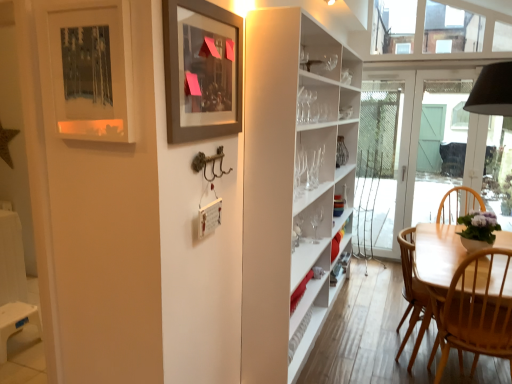
Question: Is light wood chair at lower right positioned beyond the bounds of matte black picture frame at upper left, which is counted as the first picture frame, starting from the left?

Choices:
 (A) no
 (B) yes

Answer: (B)

Question: Is light wood chair at lower right shorter than matte black picture frame at upper left, which ranks as the 2th picture frame in right-to-left order?

Choices:
 (A) no
 (B) yes

Answer: (A)

Question: Would you consider light wood chair at lower right to be distant from matte black picture frame at upper left, which ranks as the 2th picture frame in right-to-left order?

Choices:
 (A) yes
 (B) no

Answer: (A)

Question: Is light wood chair at lower right oriented towards matte black picture frame at upper left, which ranks as the 2th picture frame in right-to-left order?

Choices:
 (A) yes
 (B) no

Answer: (B)

Question: Is matte black picture frame at upper left, which is counted as the first picture frame, starting from the left, completely or partially inside light wood chair at lower right?

Choices:
 (A) no
 (B) yes

Answer: (A)

Question: Relative to white glass door at center, is matte black picture frame at upper left, which is counted as the first picture frame, starting from the left, in front or behind?

Choices:
 (A) front
 (B) behind

Answer: (A)

Question: In terms of height, does matte black picture frame at upper left, which is counted as the first picture frame, starting from the left, look taller or shorter compared to white glass door at center?

Choices:
 (A) tall
 (B) short

Answer: (B)

Question: Considering the relative positions of matte black picture frame at upper left, which is counted as the first picture frame, starting from the left, and white glass door at center in the image provided, is matte black picture frame at upper left, which is counted as the first picture frame, starting from the left, to the left or to the right of white glass door at center?

Choices:
 (A) left
 (B) right

Answer: (A)

Question: Is point (69, 89) positioned closer to the camera than point (437, 86)?

Choices:
 (A) closer
 (B) farther

Answer: (A)

Question: Is white glass door at center inside or outside of light wood chair at lower right?

Choices:
 (A) outside
 (B) inside

Answer: (A)

Question: Is white glass door at center to the left or to the right of light wood chair at lower right in the image?

Choices:
 (A) left
 (B) right

Answer: (B)

Question: In terms of width, does white glass door at center look wider or thinner when compared to light wood chair at lower right?

Choices:
 (A) wide
 (B) thin

Answer: (B)

Question: Is white glass door at center taller or shorter than light wood chair at lower right?

Choices:
 (A) short
 (B) tall

Answer: (B)

Question: Looking at their shapes, would you say matte gray picture frame at upper center, which is the second picture frame from left to right, is wider or thinner than light wood chair at lower right?

Choices:
 (A) thin
 (B) wide

Answer: (A)

Question: In terms of height, does matte gray picture frame at upper center, which is the first picture frame in right-to-left order, look taller or shorter compared to light wood chair at lower right?

Choices:
 (A) short
 (B) tall

Answer: (A)